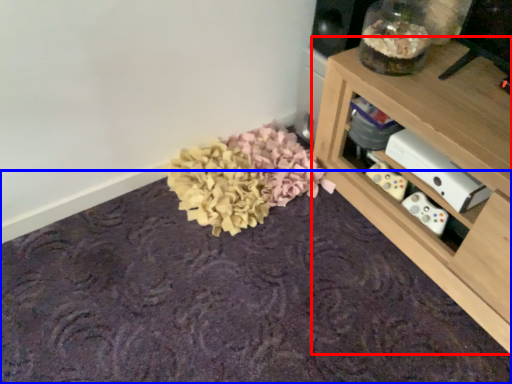
Question: Which point is further to the camera, shelf (highlighted by a red box) or mat (highlighted by a blue box)?

Choices:
 (A) shelf
 (B) mat

Answer: (A)